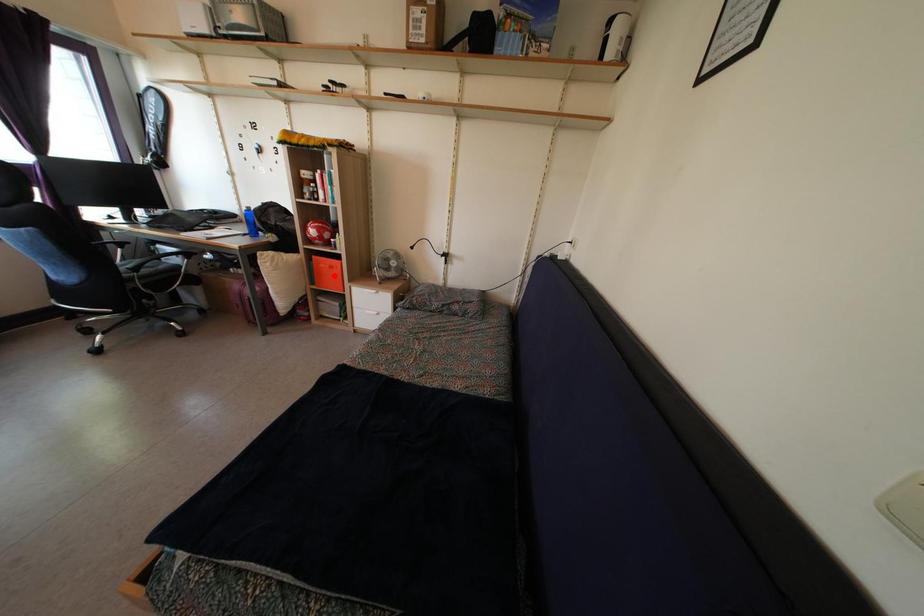
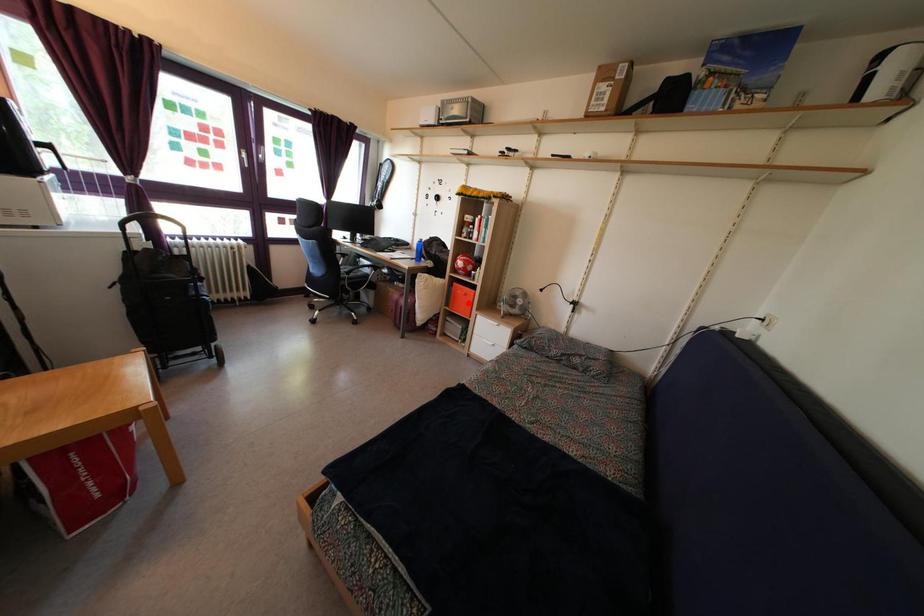
I am providing you with two images of the same scene from different viewpoints. A red point is marked on the first image and another point is marked on the second image. Is the marked point in image1 the same physical position as the marked point in image2?

Yes